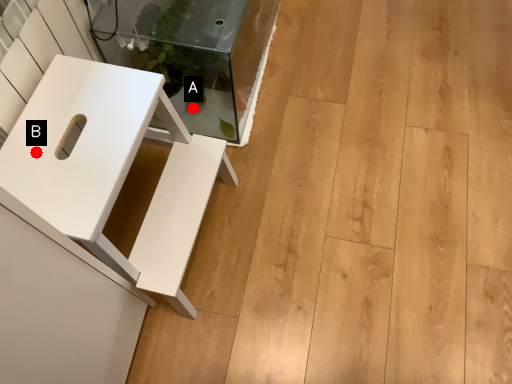
Question: Two points are circled on the image, labeled by A and B beside each circle. Which point is farther from the camera taking this photo?

Choices:
 (A) A is further
 (B) B is further

Answer: (A)